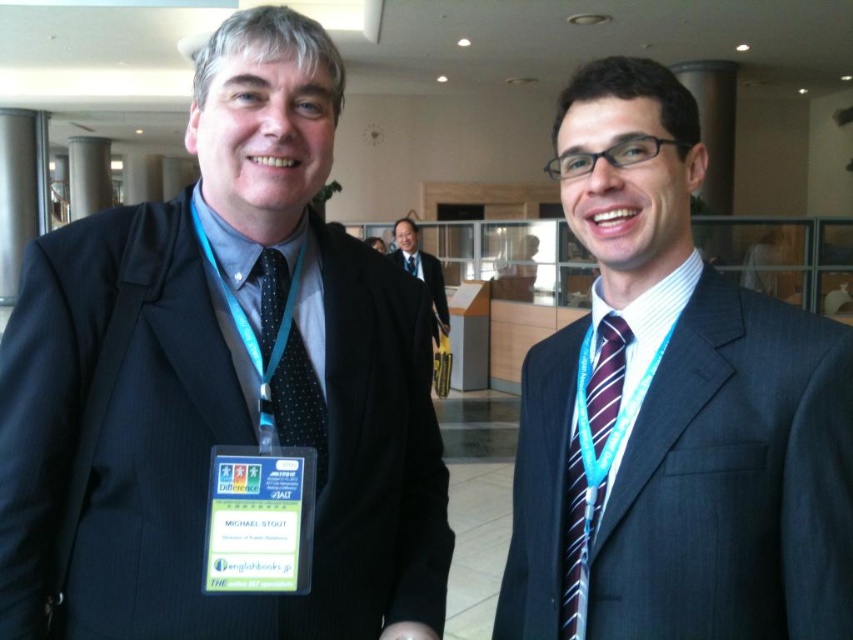
You are a tailor observing two men in a professional setting. You need to determine which tie, the striped silk tie at right or the black dotted tie at left, requires more fabric to make. Based on their widths, which one would need more material?

The black dotted tie at left has a greater width than the striped silk tie at right, so it would require more fabric to make.